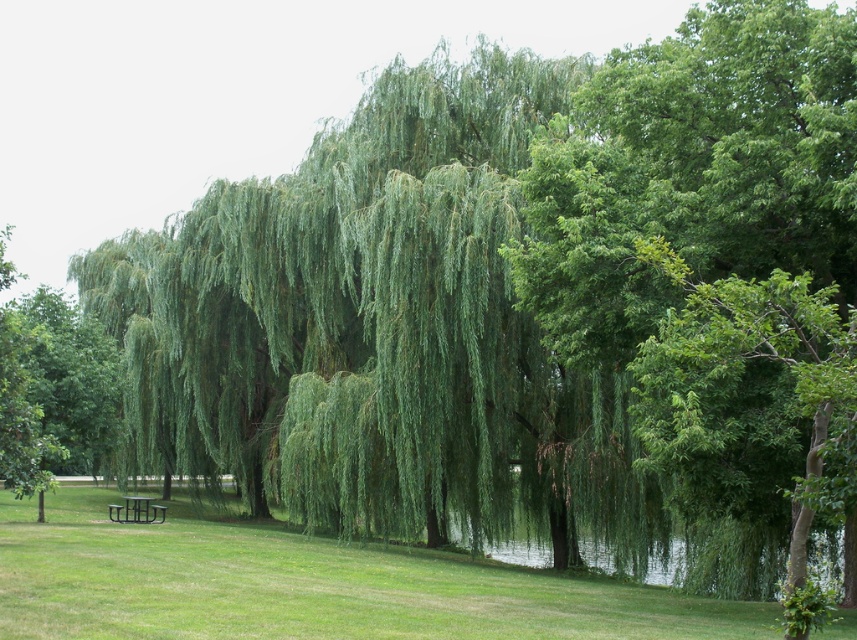
Question: Which object appears farthest from the camera in this image?

Choices:
 (A) green metallic picnic table at lower left
 (B) green grassy at lower center

Answer: (A)

Question: Can you confirm if green grassy at lower center is positioned below green metallic picnic table at lower left?

Choices:
 (A) yes
 (B) no

Answer: (B)

Question: Does green grassy at lower center appear under green metallic picnic table at lower left?

Choices:
 (A) yes
 (B) no

Answer: (B)

Question: Which of the following is the farthest from the observer?

Choices:
 (A) green metallic picnic table at lower left
 (B) green grassy at lower center

Answer: (A)

Question: Does green grassy at lower center have a lesser width compared to green metallic picnic table at lower left?

Choices:
 (A) no
 (B) yes

Answer: (A)